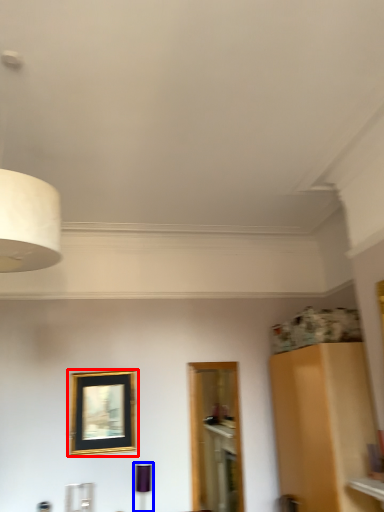
Question: Which point is closer to the camera, picture frame (highlighted by a red box) or lamp (highlighted by a blue box)?

Choices:
 (A) picture frame
 (B) lamp

Answer: (B)